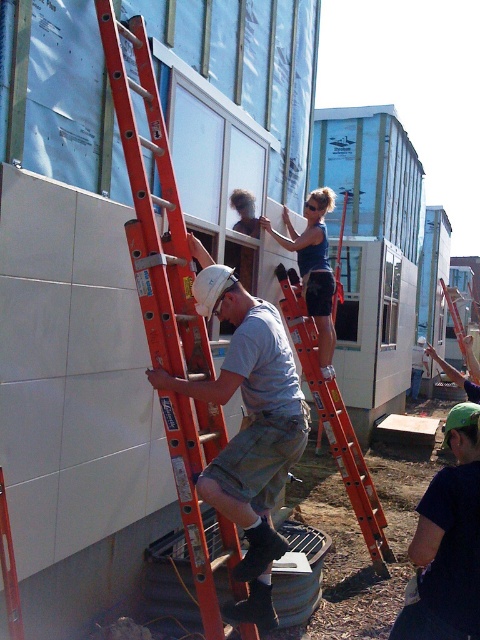
You are a safety inspector observing the construction site. You notice two orange fiberglass ladders in the scene. According to safety protocols, ladders should not be placed closer than 2 meters apart to avoid collision. Can you determine if the distance between the orange fiberglass ladder at left and the orange fiberglass ladder at center meets this requirement?

The orange fiberglass ladder at left is to the left of orange fiberglass ladder at center, but the exact distance between them is not provided. Therefore, I cannot confirm if they are at least 2 meters apart as required by safety protocols.

From the picture: You are a safety inspector reviewing the construction site. You notice a white matte hard hat at center. Where exactly is it positioned in the image coordinates?

The white matte hard hat at center is located at point coordinates (249, 428).